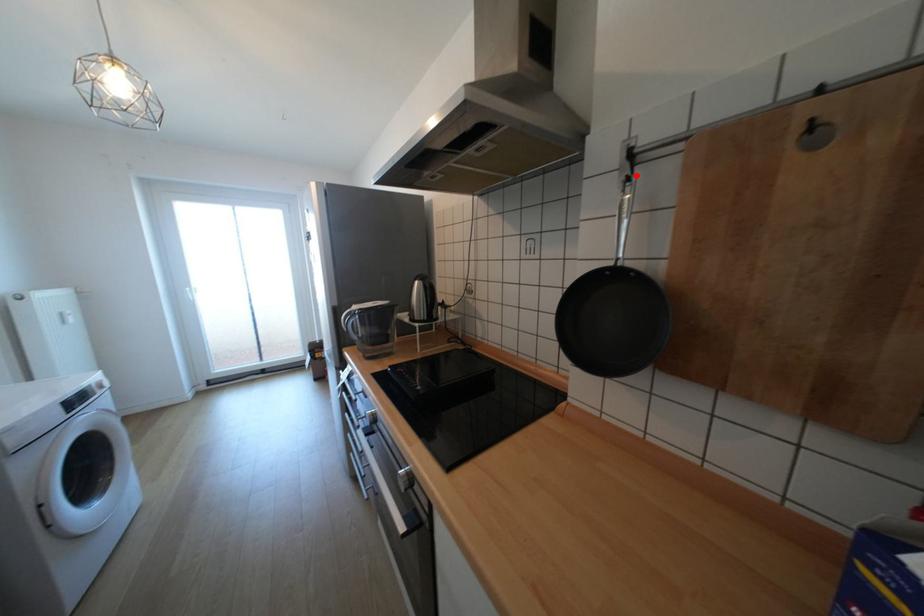
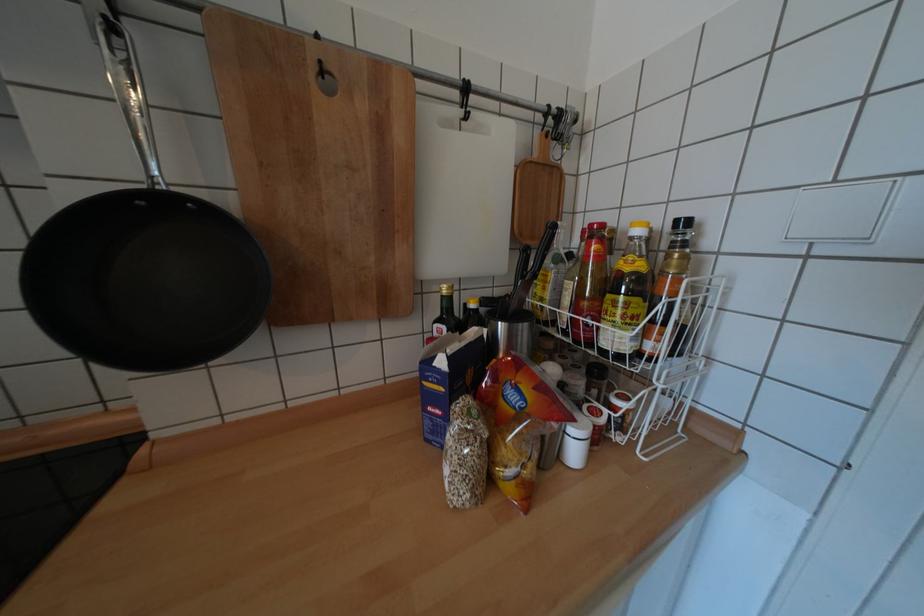
The point at the highlighted location is marked in the first image. Where is the corresponding point in the second image?

(115, 18)